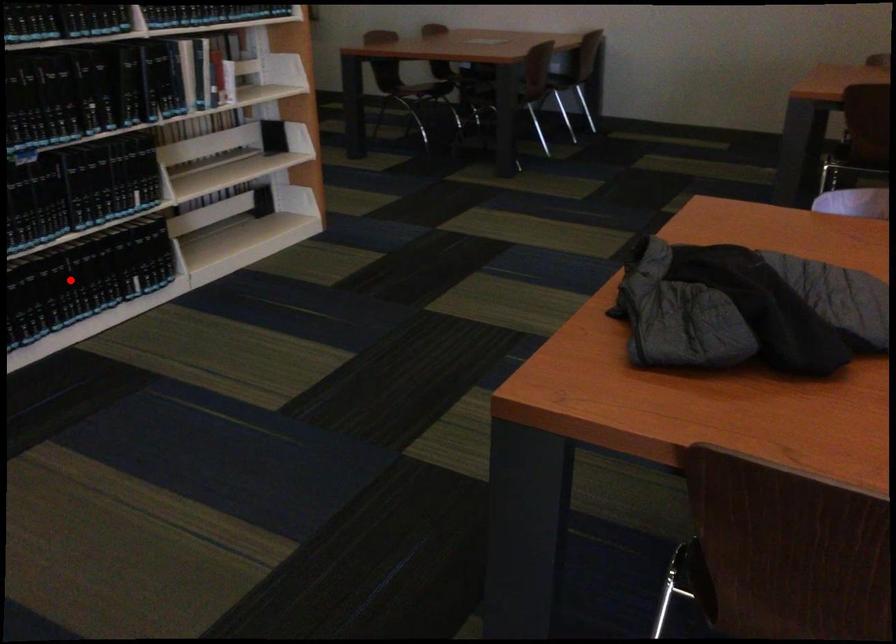
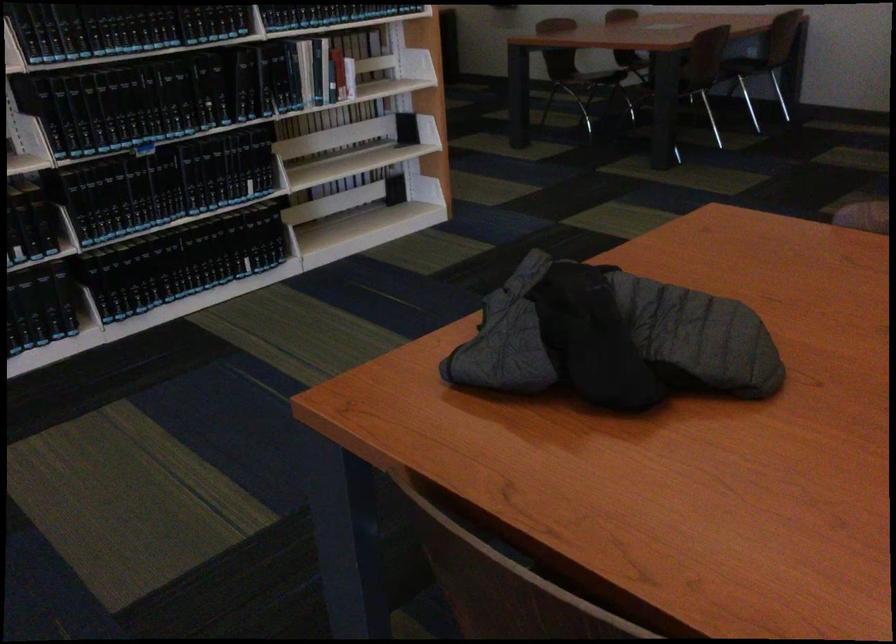
Question: I am providing you with two images of the same scene from different viewpoints. In image1, a red point is highlighted. Considering the same 3D point in image2, which of the following is correct?

Choices:
 (A) It is closer
 (B) It is farther

Answer: (B)